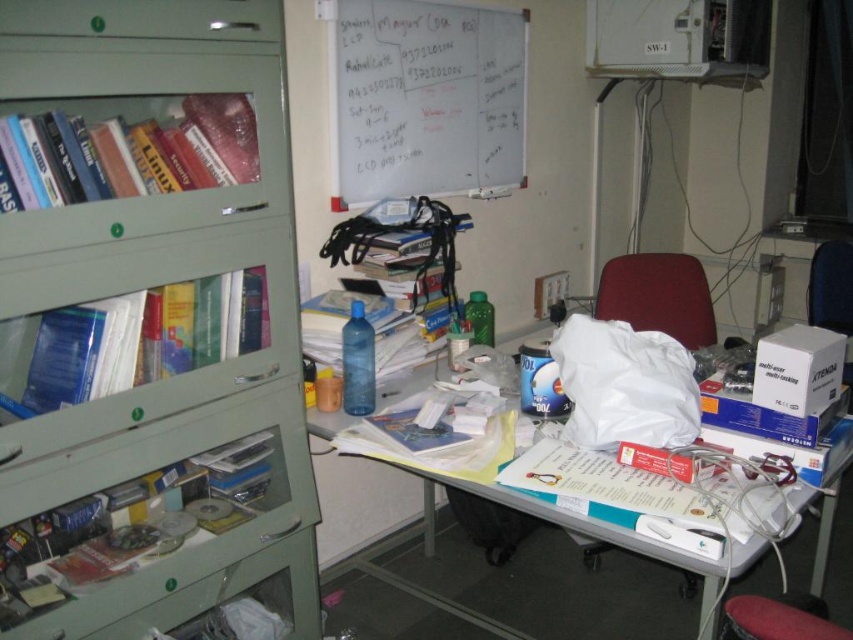
You are standing in the office and need to place a new book on the green matte bookshelf at left. What is the exact 2D coordinate where you should place the book?

The exact 2D coordinate for the green matte bookshelf at left is at point (149, 324).